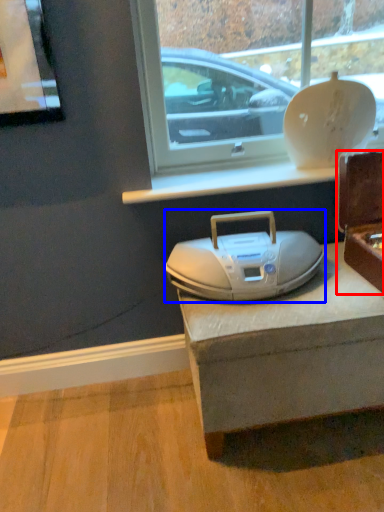
Question: Among these objects, which one is farthest to the camera, box (highlighted by a red box) or appliance (highlighted by a blue box)?

Choices:
 (A) box
 (B) appliance

Answer: (B)